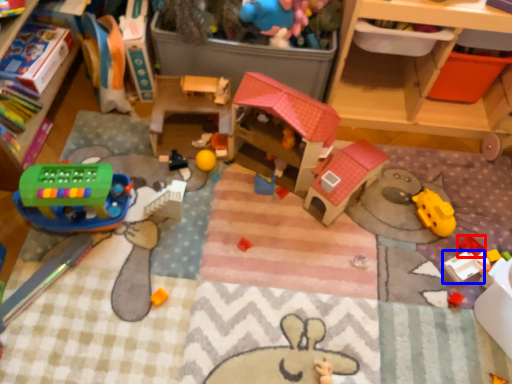
Question: Which point is closer to the camera, toy (highlighted by a red box) or toy (highlighted by a blue box)?

Choices:
 (A) toy
 (B) toy

Answer: (B)